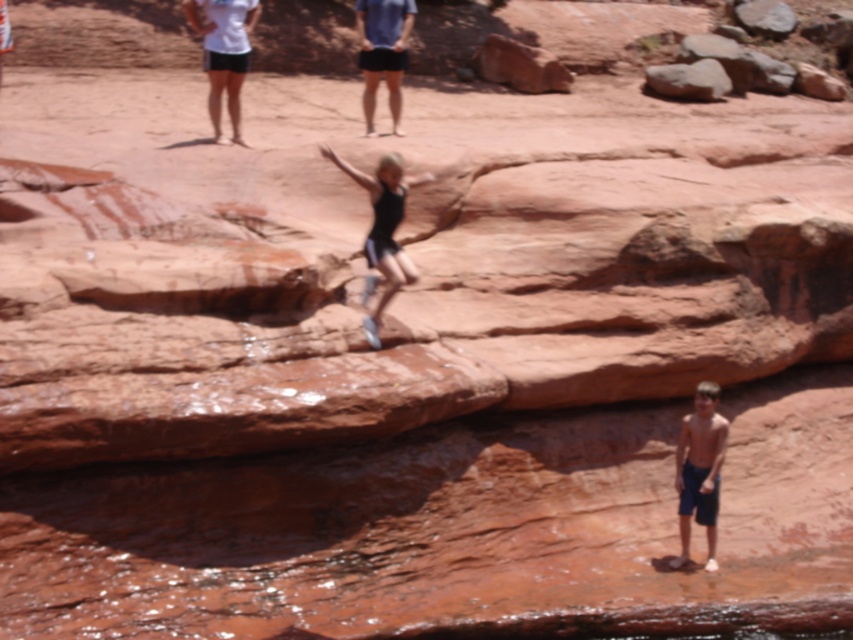
Question: Does smooth reddish rock at upper center come in front of smooth rock at upper center?

Choices:
 (A) no
 (B) yes

Answer: (B)

Question: Based on their relative distances, which object is nearer to the matte blue shorts at center?

Choices:
 (A) smooth reddish rock at upper center
 (B) black matte shorts at center

Answer: (B)

Question: Which object is farther from the camera taking this photo?

Choices:
 (A) matte blue shorts at center
 (B) shiny blue shorts at lower right

Answer: (A)

Question: Does matte blue shorts at center have a larger size compared to smooth reddish rock at upper center?

Choices:
 (A) yes
 (B) no

Answer: (B)

Question: Which object appears farthest from the camera in this image?

Choices:
 (A) shiny blue shorts at lower right
 (B) black matte shorts at center
 (C) smooth rock at upper center
 (D) smooth reddish rock at upper center

Answer: (C)

Question: Is shiny blue shorts at lower right thinner than smooth rock at upper center?

Choices:
 (A) yes
 (B) no

Answer: (A)